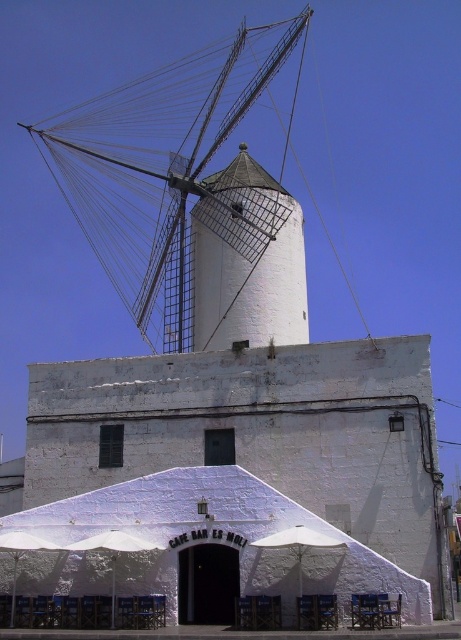
Question: Is white fabric canopy at lower center above white fabric umbrella at lower center?

Choices:
 (A) no
 (B) yes

Answer: (A)

Question: Does white painted wood windmill at upper center have a smaller size compared to white fabric canopy at lower center?

Choices:
 (A) no
 (B) yes

Answer: (A)

Question: Which is farther from the white fabric umbrella at lower center?

Choices:
 (A) white fabric canopy at lower center
 (B) white painted wood windmill at upper center

Answer: (B)

Question: Observing the image, what is the correct spatial positioning of white fabric canopy at lower center in reference to white fabric umbrella at lower center?

Choices:
 (A) below
 (B) above

Answer: (A)

Question: Among these objects, which one is nearest to the camera?

Choices:
 (A) white fabric canopy at lower center
 (B) white fabric umbrella at lower center

Answer: (A)

Question: Which object is positioned closest to the white painted wood windmill at upper center?

Choices:
 (A) white fabric umbrella at lower center
 (B) white fabric canopy at lower center

Answer: (B)